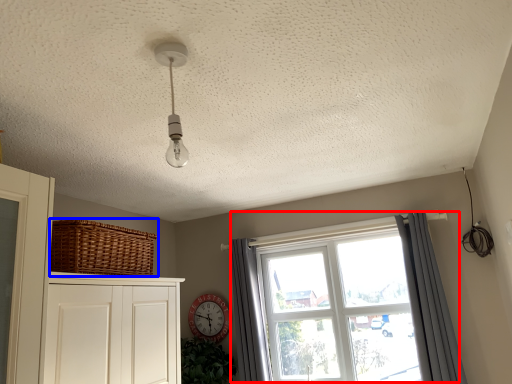
Question: Among these objects, which one is nearest to the camera, window (highlighted by a red box) or basket (highlighted by a blue box)?

Choices:
 (A) window
 (B) basket

Answer: (B)